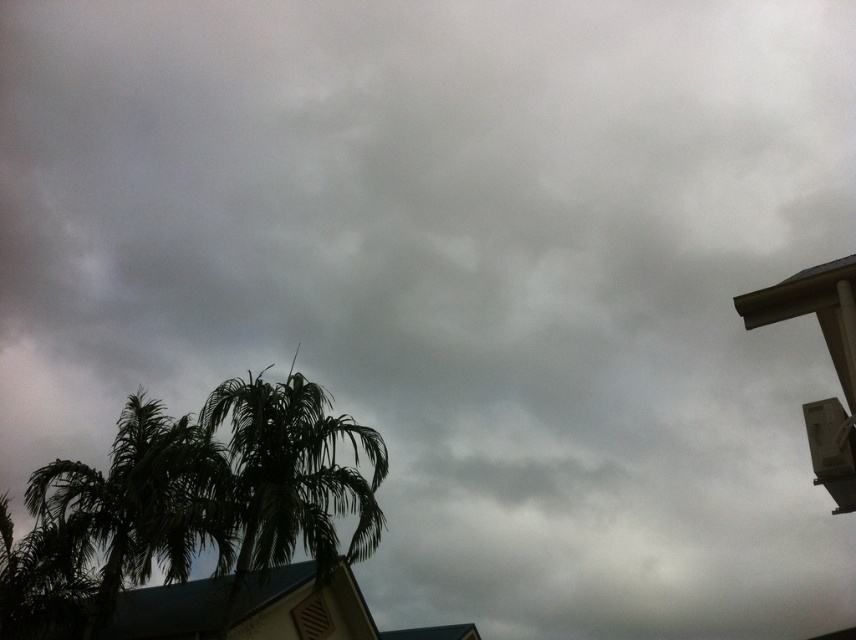
You are standing in front of a house with a sloped roof and see two trees in the distance. The dark green leafy tree at lower left and the green leafy palm tree at center. Which tree is positioned more to the left side of the scene?

The dark green leafy tree at lower left is positioned more to the left side of the scene compared to the green leafy palm tree at center.